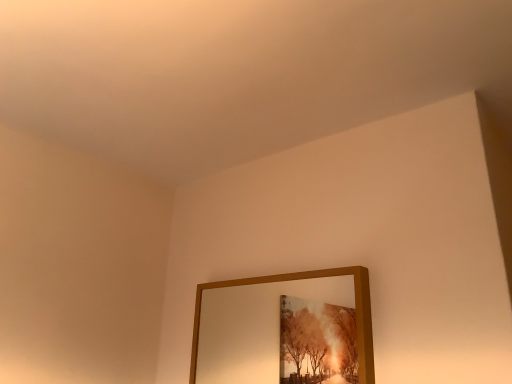
Consider the image. What is the approximate height of gold wooden picture frame at upper center?

gold wooden picture frame at upper center is 14.89 inches tall.

Image resolution: width=512 pixels, height=384 pixels. What do you see at coordinates (300, 279) in the screenshot? I see `gold wooden picture frame at upper center` at bounding box center [300, 279].

Image resolution: width=512 pixels, height=384 pixels. What are the coordinates of `gold wooden picture frame at upper center` in the screenshot? It's located at (300, 279).

Find the location of a particular element. The image size is (512, 384). gold wooden picture frame at upper center is located at coordinates (300, 279).